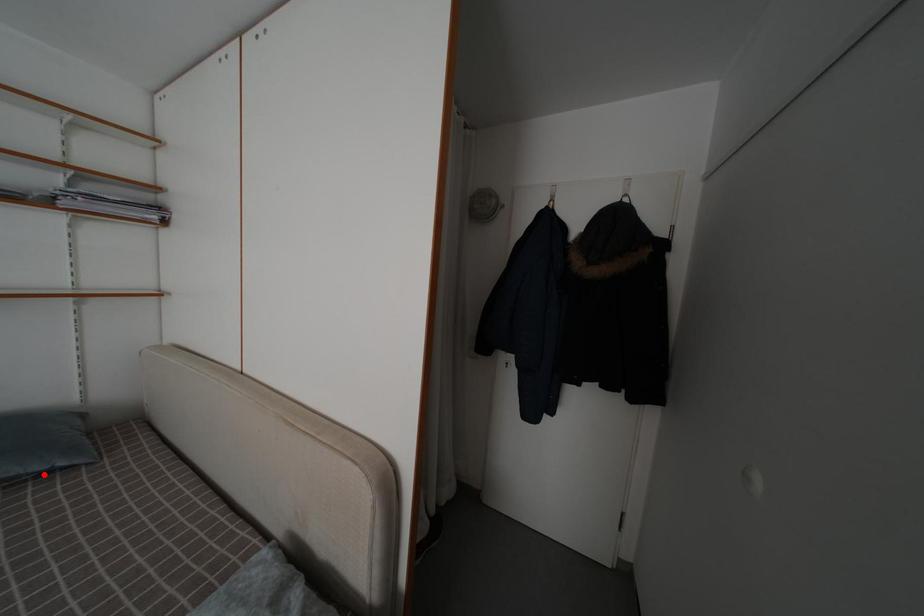
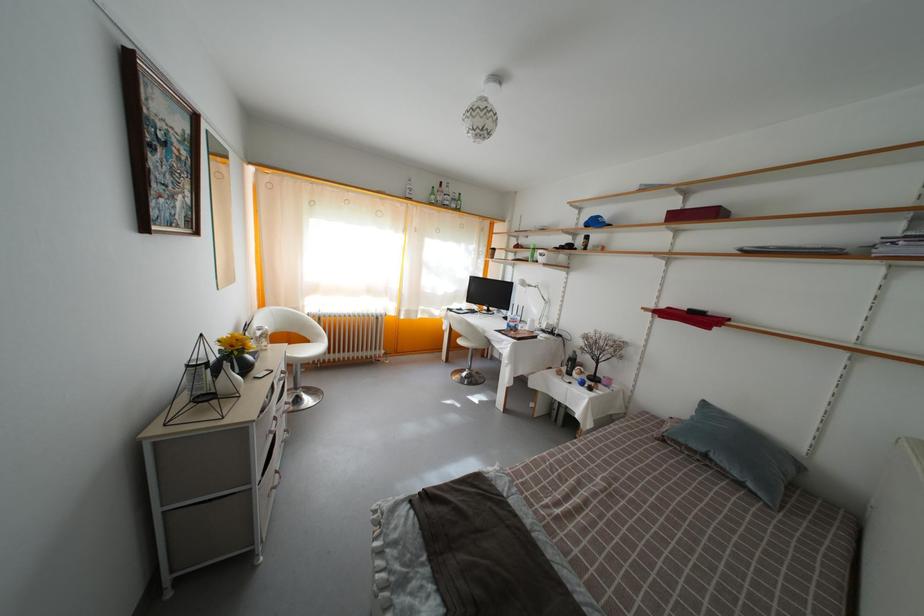
Find the pixel in the second image that matches the highlighted location in the first image.

(743, 482)